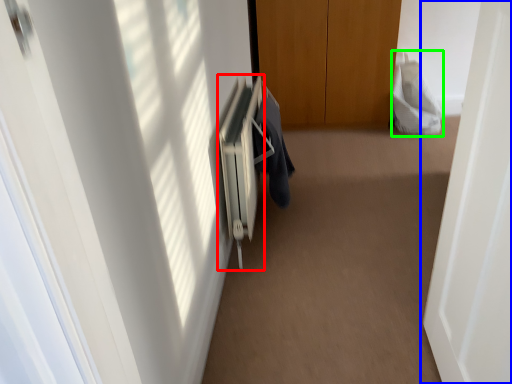
Question: Which is nearer to the radiator (highlighted by a red box)? door (highlighted by a blue box) or robe (highlighted by a green box).

Choices:
 (A) door
 (B) robe

Answer: (A)